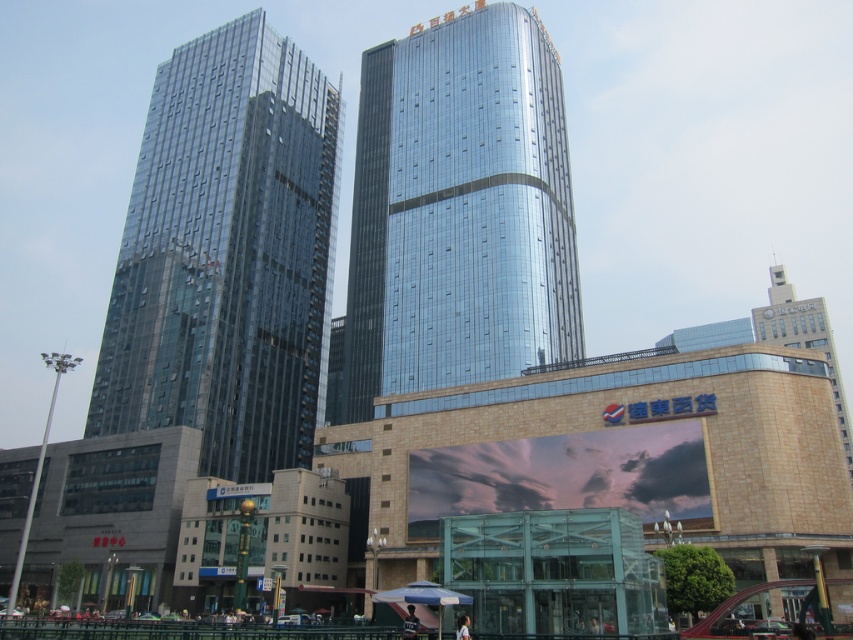
Question: Is glossy glass building at center smaller than white striped fabric umbrella at lower center?

Choices:
 (A) yes
 (B) no

Answer: (B)

Question: Which of these objects is positioned farthest from the white striped fabric umbrella at lower center?

Choices:
 (A) transparent glass skyscraper at center
 (B) beige stone tower at right

Answer: (B)

Question: In this image, where is glossy glass building at center located relative to white striped fabric umbrella at lower center?

Choices:
 (A) above
 (B) below

Answer: (A)

Question: Among these objects, which one is farthest from the camera?

Choices:
 (A) glossy glass building at center
 (B) white striped fabric umbrella at lower center
 (C) transparent glass skyscraper at center

Answer: (C)

Question: Does transparent glass skyscraper at center appear on the left side of glossy glass building at center?

Choices:
 (A) yes
 (B) no

Answer: (A)

Question: Which of these objects is positioned farthest from the transparent glass skyscraper at center?

Choices:
 (A) glossy glass building at center
 (B) beige stone tower at right

Answer: (B)